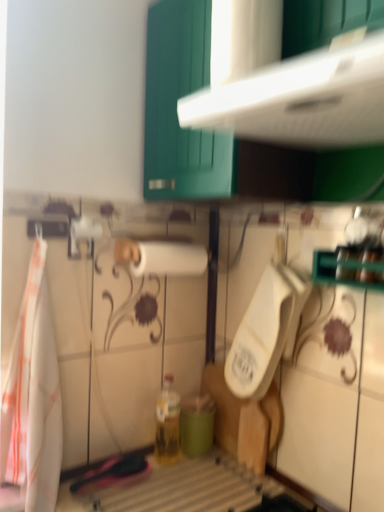
Question: Is teal matte cup at lower center spatially inside translucent glass bottle at center, or outside of it?

Choices:
 (A) outside
 (B) inside

Answer: (A)

Question: Considering the positions of teal matte cup at lower center and translucent glass bottle at center in the image, is teal matte cup at lower center taller or shorter than translucent glass bottle at center?

Choices:
 (A) tall
 (B) short

Answer: (B)

Question: Which is farther from the white matte paper towel at center?

Choices:
 (A) white plastic urinal at center
 (B) translucent glass bottle at center
 (C) white plastic cabinet at upper center
 (D) teal matte cup at lower center
 (E) white fabric towel at left

Answer: (D)

Question: Estimate the real-world distances between objects in this image. Which object is farther from the white plastic cabinet at upper center?

Choices:
 (A) white fabric towel at left
 (B) translucent glass bottle at center
 (C) white plastic urinal at center
 (D) teal matte cup at lower center
 (E) white matte paper towel at center

Answer: (D)